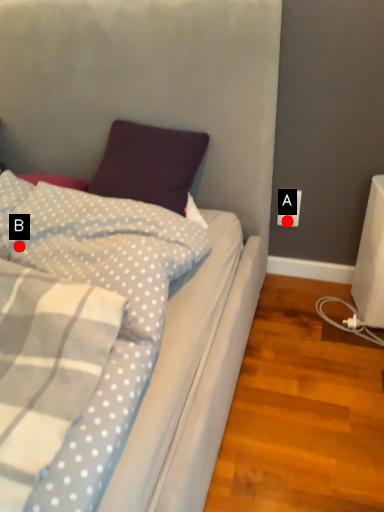
Question: Two points are circled on the image, labeled by A and B beside each circle. Which point is closer to the camera taking this photo?

Choices:
 (A) A is closer
 (B) B is closer

Answer: (B)